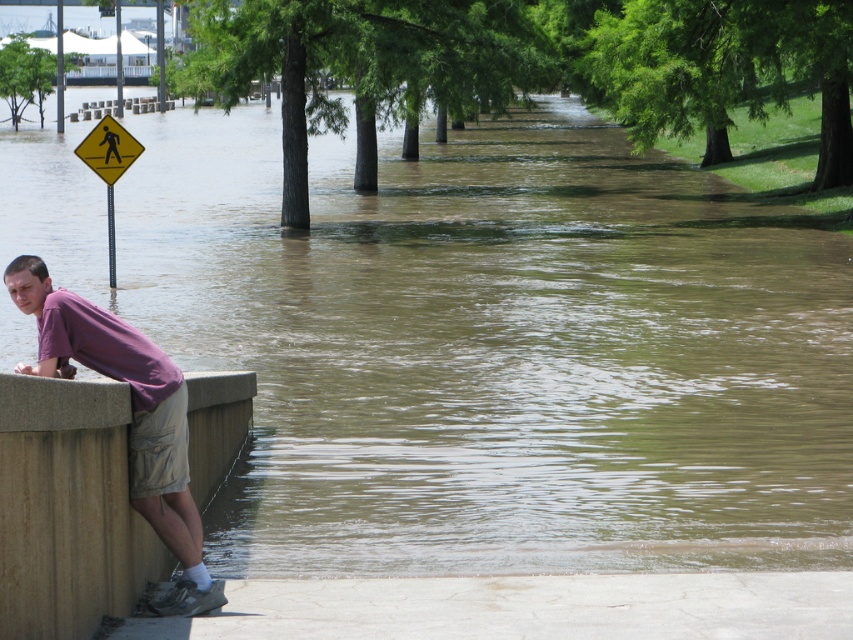
Question: Which object is the closest to the yellow diamond-shaped sign at left?

Choices:
 (A) purple cotton shirt at lower left
 (B) yellow diamond at left

Answer: (B)

Question: Estimate the real-world distances between objects in this image. Which object is closer to the yellow diamond at left?

Choices:
 (A) purple cotton shirt at lower left
 (B) yellow diamond-shaped sign at left

Answer: (B)

Question: Is purple cotton shirt at lower left to the right of yellow diamond-shaped sign at left from the viewer's perspective?

Choices:
 (A) no
 (B) yes

Answer: (B)

Question: Among these points, which one is farthest from the camera?

Choices:
 (A) (138, 444)
 (B) (135, 140)

Answer: (B)

Question: Can you confirm if yellow diamond-shaped sign at left is positioned to the right of yellow diamond at left?

Choices:
 (A) no
 (B) yes

Answer: (A)

Question: Can you confirm if yellow diamond-shaped sign at left is positioned to the right of yellow diamond at left?

Choices:
 (A) no
 (B) yes

Answer: (A)